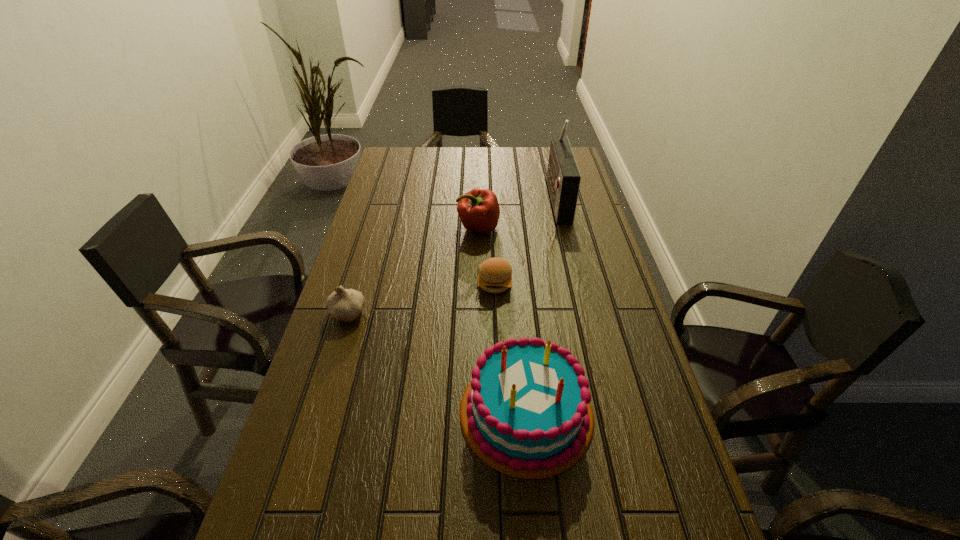
Locate an element on the screen. The height and width of the screenshot is (540, 960). empty space that is in between the fourth farthest object and the hamburger is located at coordinates (421, 299).

Locate an element on the screen. object that is the closest one to the tallest object is located at coordinates (478, 209).

Image resolution: width=960 pixels, height=540 pixels. In order to click on the second closest object to the rightmost object in this screenshot , I will do `click(495, 274)`.

At what (x,y) coordinates should I click in order to perform the action: click on vacant region that satisfies the following two spatial constraints: 1. on the front panel of the radio receiver; 2. on the front side of the birthday cake. Please return your answer as a coordinate pair (x, y). Looking at the image, I should click on (609, 412).

Locate an element on the screen. The width and height of the screenshot is (960, 540). vacant space that satisfies the following two spatial constraints: 1. on the front side of the fourth shortest object; 2. on the right side of the shortest object is located at coordinates (500, 412).